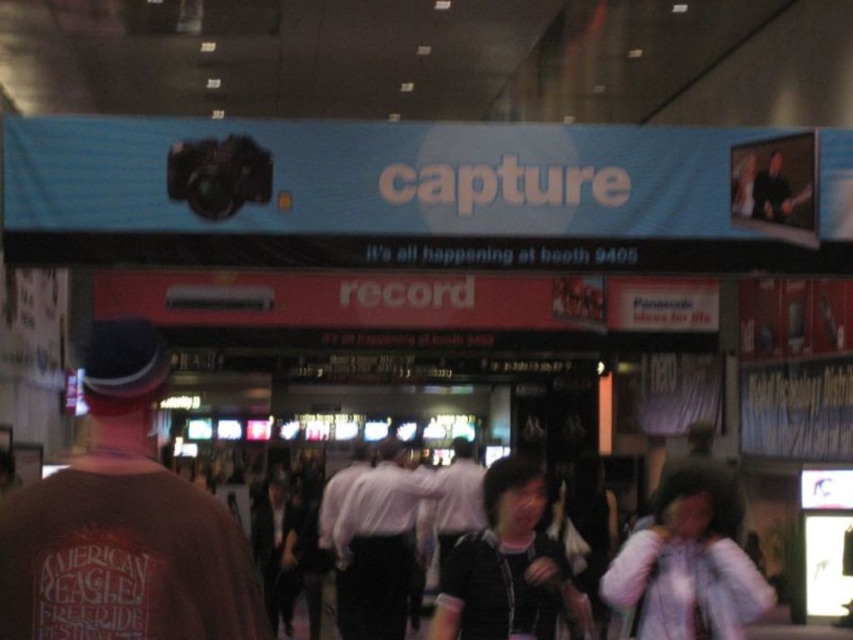
Does brown cotton t-shirt at left lie behind black fabric people at center?

No, it is in front of black fabric people at center.

Is brown cotton t-shirt at left thinner than black fabric people at center?

In fact, brown cotton t-shirt at left might be wider than black fabric people at center.

Is point (74, 568) in front of point (721, 544)?

Yes.

I want to click on brown cotton t-shirt at left, so click(x=123, y=525).

Does brown cotton t-shirt at left appear on the left side of white shirt at center?

Correct, you'll find brown cotton t-shirt at left to the left of white shirt at center.

Is brown cotton t-shirt at left below white shirt at center?

No.

Identify the location of brown cotton t-shirt at left. This screenshot has width=853, height=640. (123, 525).

Between black fabric people at center and white shirt at center, which one is positioned lower?

white shirt at center is below.

Can you confirm if black fabric people at center is shorter than white shirt at center?

Yes.

This screenshot has height=640, width=853. In order to click on black fabric people at center in this screenshot , I will do `click(688, 561)`.